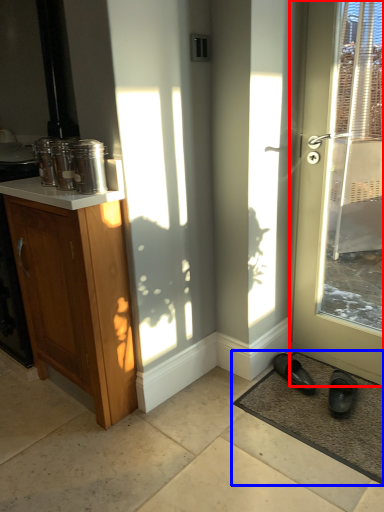
Question: Which object is closer to the camera taking this photo, door (highlighted by a red box) or doormat (highlighted by a blue box)?

Choices:
 (A) door
 (B) doormat

Answer: (A)